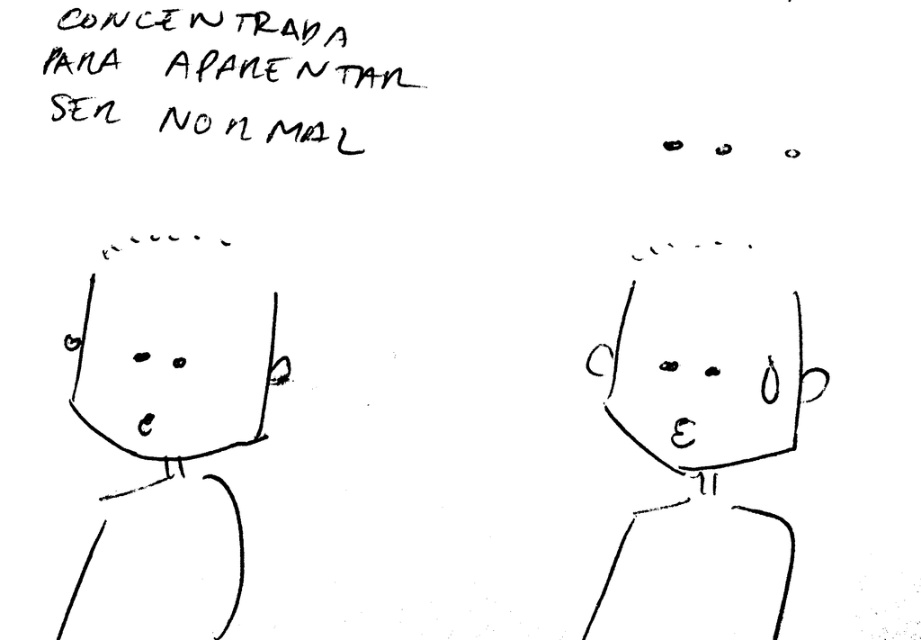
You are an art student analyzing a drawing. You observe the black line drawing face at left and the smooth black face at center. Which of these two faces is placed higher in the drawing?

The black line drawing face at left is positioned over smooth black face at center, so it is placed higher in the drawing.

Consider the image. You are an art student analyzing a black and white drawing. You notice two faces in the image. The first is a black line drawing face at left, and the second is a smooth black face at center. Based on their positions, which face is located to the right?

The smooth black face at center is to the right of the black line drawing face at left.

Looking at this image, you are an art student analyzing a black and white drawing of two faces. You need to determine which face is narrower. The faces are the black line drawing face at left and the smooth black face at center. Which one is narrower?

The black line drawing face at left is narrower because it has a lesser width compared to the smooth black face at center.